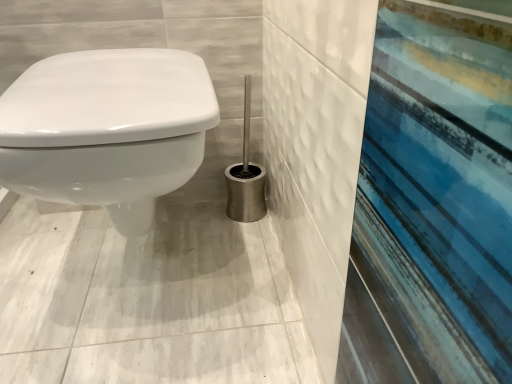
The height and width of the screenshot is (384, 512). I want to click on vacant area that lies between white glossy toilet at left and satin silver toilet brush at center, so click(x=230, y=244).